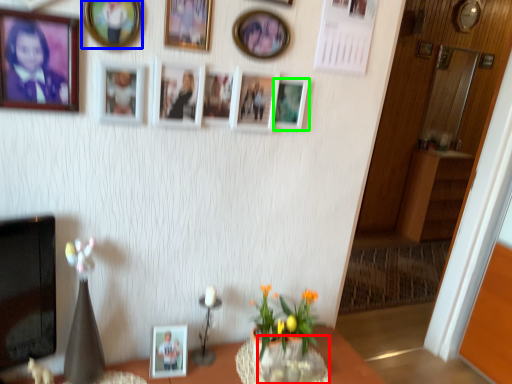
Question: Which object is positioned farthest from glass vase (highlighted by a red box)? Select from picture frame (highlighted by a blue box) and picture frame (highlighted by a green box).

Choices:
 (A) picture frame
 (B) picture frame

Answer: (A)